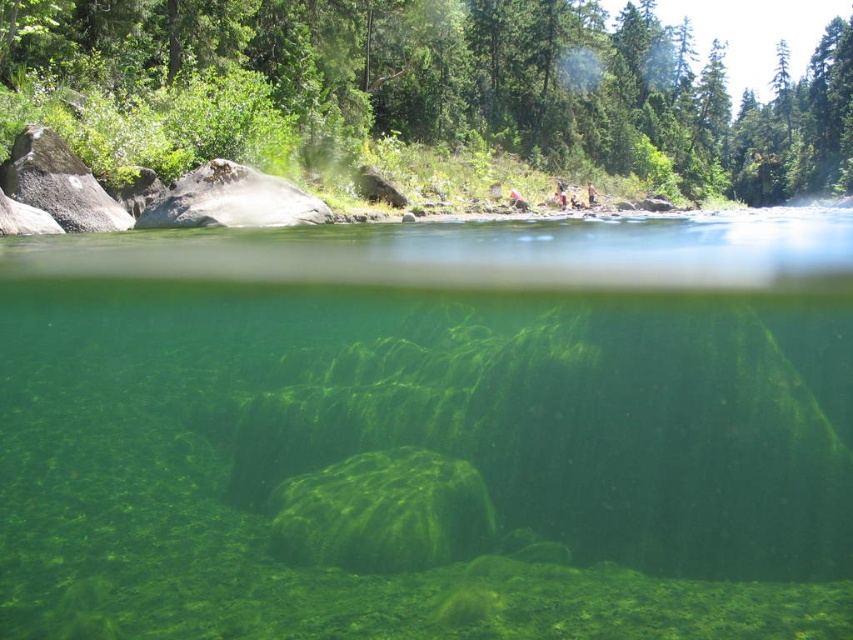
Between point (149, 500) and point (77, 93), which one is positioned behind?

Positioned behind is point (77, 93).

Image resolution: width=853 pixels, height=640 pixels. What do you see at coordinates (430, 429) in the screenshot?
I see `transparent green algae at center` at bounding box center [430, 429].

I want to click on transparent green algae at center, so click(430, 429).